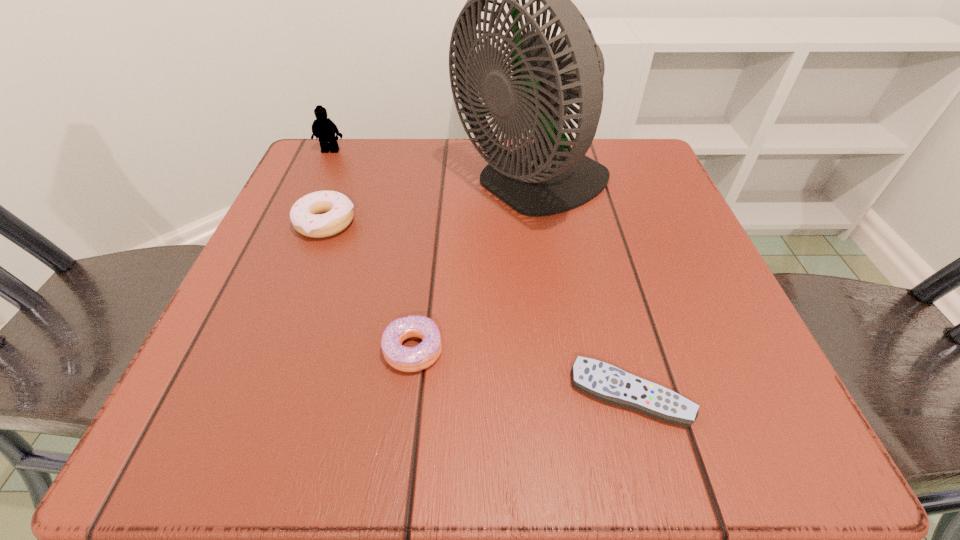
Find the location of a particular element. vacant space that satisfies the following two spatial constraints: 1. on the face of the shortest object; 2. on the right side of the second tallest object is located at coordinates (221, 394).

Where is `vacant region that satisfies the following two spatial constraints: 1. on the front side of the remote control; 2. on the left side of the left doughnut`? The width and height of the screenshot is (960, 540). vacant region that satisfies the following two spatial constraints: 1. on the front side of the remote control; 2. on the left side of the left doughnut is located at coordinates (259, 394).

Locate an element on the screen. This screenshot has height=540, width=960. vacant space that satisfies the following two spatial constraints: 1. on the face of the Lego; 2. on the right side of the remote control is located at coordinates (221, 394).

This screenshot has width=960, height=540. Identify the location of free point that satisfies the following two spatial constraints: 1. in front of the fan to direct airflow; 2. on the back side of the shortest object. (563, 394).